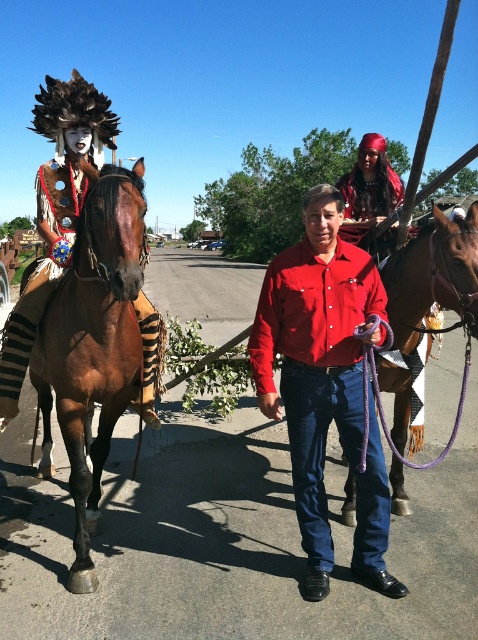
Is point (87, 467) in front of point (402, 321)?

That is False.

Is brown glossy horse at left further to camera compared to brown leather horse at center?

No, it is in front of brown leather horse at center.

Between point (85, 348) and point (398, 499), which one is positioned behind?

The point (398, 499) is more distant.

This screenshot has height=640, width=478. In order to click on brown glossy horse at left in this screenshot , I will do `click(93, 346)`.

Is brown glossy horse at left positioned at the back of shiny red fabric at upper right?

No, it is in front of shiny red fabric at upper right.

Who is more forward, (76, 564) or (389, 188)?

Point (76, 564) is more forward.

Locate an element on the screen. The width and height of the screenshot is (478, 640). brown glossy horse at left is located at coordinates (93, 346).

Can you confirm if red cotton shirt at center is positioned above brown glossy horse at left?

Correct, red cotton shirt at center is located above brown glossy horse at left.

You are a GUI agent. You are given a task and a screenshot of the screen. Output one action in this format:
    pyautogui.click(x=<x>, y=<y>)
    Task: Click on the red cotton shirt at center
    
    Given the screenshot: What is the action you would take?
    pyautogui.click(x=325, y=384)

This screenshot has height=640, width=478. I want to click on red cotton shirt at center, so (x=325, y=384).